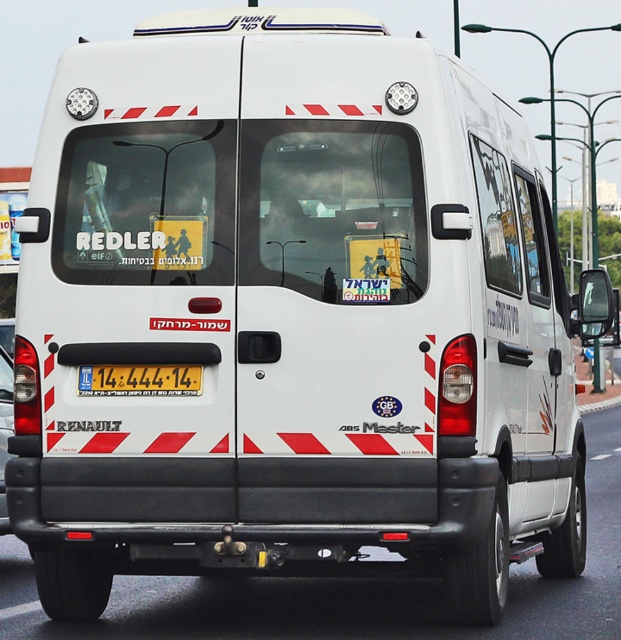
Question: Among these points, which one is farthest from the camera?

Choices:
 (A) (0, 408)
 (B) (201, 378)

Answer: (A)

Question: Which object appears farthest from the camera in this image?

Choices:
 (A) yellow plastic license plate at center
 (B) white matte van at center

Answer: (B)

Question: Does yellow plastic license plate at center have a greater width compared to white matte van at center?

Choices:
 (A) yes
 (B) no

Answer: (A)

Question: Is yellow plastic license plate at center positioned in front of white matte van at center?

Choices:
 (A) yes
 (B) no

Answer: (A)

Question: Can you confirm if yellow plastic license plate at center is wider than white matte van at center?

Choices:
 (A) yes
 (B) no

Answer: (A)